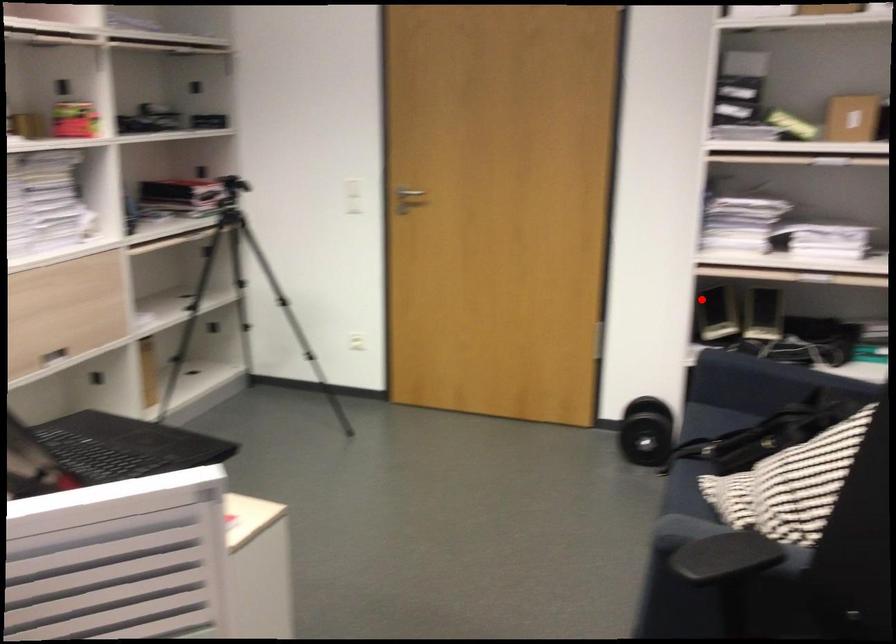
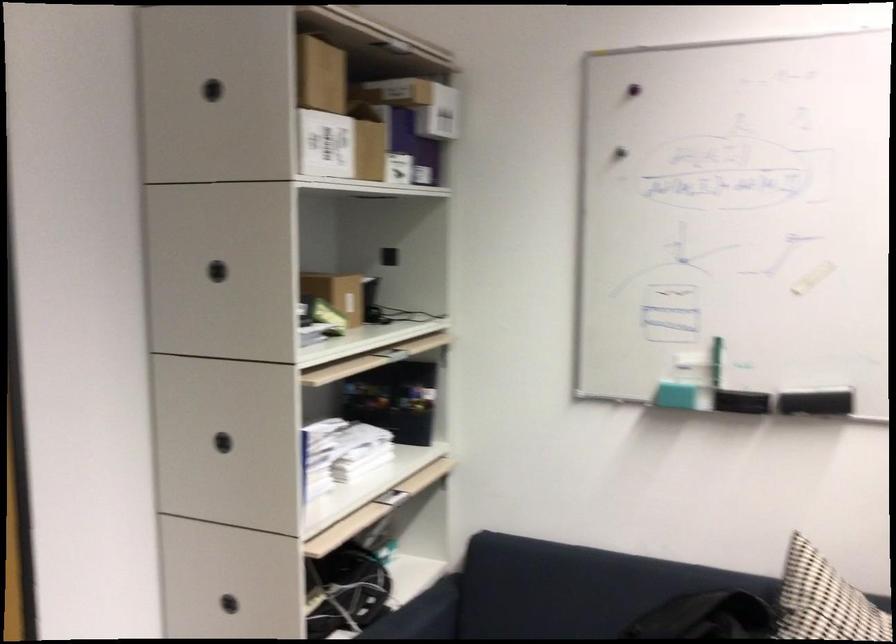
Question: I am providing you with two images of the same scene from different viewpoints. Given a red point in image1, look at the same physical point in image2. Is it:

Choices:
 (A) Closer to the viewpoint
 (B) Farther from the viewpoint

Answer: (A)